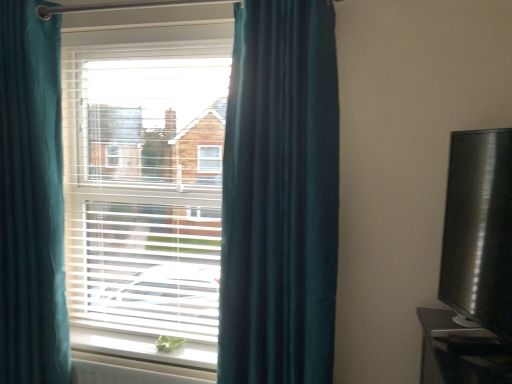
Question: From the image's perspective, is white plastic radiator at lower center positioned above or below white matte window sill at lower center?

Choices:
 (A) above
 (B) below

Answer: (B)

Question: Is point (116, 365) closer or farther from the camera than point (151, 344)?

Choices:
 (A) closer
 (B) farther

Answer: (A)

Question: Which is nearer to the teal fabric curtain at left, acting as the 1th curtain starting from the left?

Choices:
 (A) white plastic radiator at lower center
 (B) white matte window sill at lower center
 (C) black glossy tv at right
 (D) teal velvet curtain at left, which is the 2th curtain in left-to-right order
 (E) white plastic blinds at center

Answer: (E)

Question: Estimate the real-world distances between objects in this image. Which object is farther from the white plastic blinds at center?

Choices:
 (A) white plastic radiator at lower center
 (B) white matte window sill at lower center
 (C) black glossy tv at right
 (D) teal fabric curtain at left, the second curtain from the right
 (E) teal velvet curtain at left, which is the 2th curtain in left-to-right order

Answer: (C)